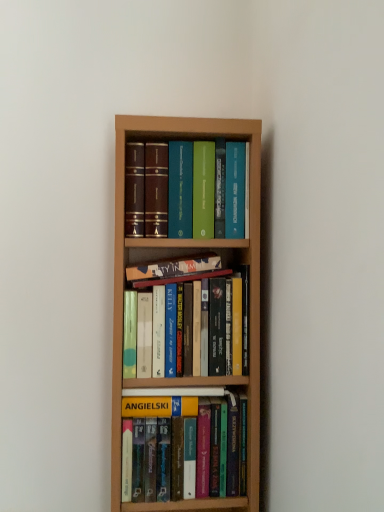
Question: Which direction should I rotate to face hardcover book at center, arranged as the third book when ordered from the bottom, — up or down?

Choices:
 (A) up
 (B) down

Answer: (B)

Question: Can you confirm if hardcover book at center, the second book in the top-to-bottom sequence, is wider than hardcover books at center, the third book in the top-to-bottom sequence?

Choices:
 (A) no
 (B) yes

Answer: (A)

Question: From a real-world perspective, is hardcover book at center, arranged as the third book when ordered from the bottom, located beneath hardcover books at center, arranged as the 2th book when ordered from the bottom?

Choices:
 (A) no
 (B) yes

Answer: (A)

Question: Considering the relative sizes of hardcover book at center, the second book in the top-to-bottom sequence, and hardcover books at center, the third book in the top-to-bottom sequence, in the image provided, is hardcover book at center, the second book in the top-to-bottom sequence, smaller than hardcover books at center, the third book in the top-to-bottom sequence,?

Choices:
 (A) yes
 (B) no

Answer: (A)

Question: Can you confirm if hardcover book at center, arranged as the third book when ordered from the bottom, is thinner than hardcover books at center, arranged as the 2th book when ordered from the bottom?

Choices:
 (A) yes
 (B) no

Answer: (A)

Question: Can hardcover books at center, the third book in the top-to-bottom sequence, be found inside hardcover book at center, the second book in the top-to-bottom sequence?

Choices:
 (A) yes
 (B) no

Answer: (B)

Question: Is hardcover book at center, arranged as the third book when ordered from the bottom, next to hardcover books at center, arranged as the 2th book when ordered from the bottom?

Choices:
 (A) yes
 (B) no

Answer: (A)

Question: Considering the relative sizes of hardcover books at center, the third book in the top-to-bottom sequence, and hardcover books at center, acting as the 1th book starting from the top, in the image provided, is hardcover books at center, the third book in the top-to-bottom sequence, wider than hardcover books at center, acting as the 1th book starting from the top,?

Choices:
 (A) yes
 (B) no

Answer: (B)

Question: Is hardcover books at center, the third book in the top-to-bottom sequence, closer to camera compared to hardcover books at center, which is the fourth book in bottom-to-top order?

Choices:
 (A) no
 (B) yes

Answer: (A)

Question: From the image's perspective, does hardcover books at center, arranged as the 2th book when ordered from the bottom, appear lower than hardcover books at center, acting as the 1th book starting from the top?

Choices:
 (A) yes
 (B) no

Answer: (A)

Question: Can you confirm if hardcover books at center, the third book in the top-to-bottom sequence, is thinner than hardcover books at center, which is the fourth book in bottom-to-top order?

Choices:
 (A) no
 (B) yes

Answer: (B)

Question: Does hardcover books at center, the third book in the top-to-bottom sequence, come behind hardcover books at center, which is the fourth book in bottom-to-top order?

Choices:
 (A) yes
 (B) no

Answer: (A)

Question: From the image's perspective, does hardcover books at center, the third book in the top-to-bottom sequence, appear higher than hardcover books at center, which is the fourth book in bottom-to-top order?

Choices:
 (A) no
 (B) yes

Answer: (A)

Question: From a real-world perspective, is hardcover book at center, which ranks as the 4th book in top-to-bottom order, physically below hardcover books at center, the third book in the top-to-bottom sequence?

Choices:
 (A) yes
 (B) no

Answer: (A)